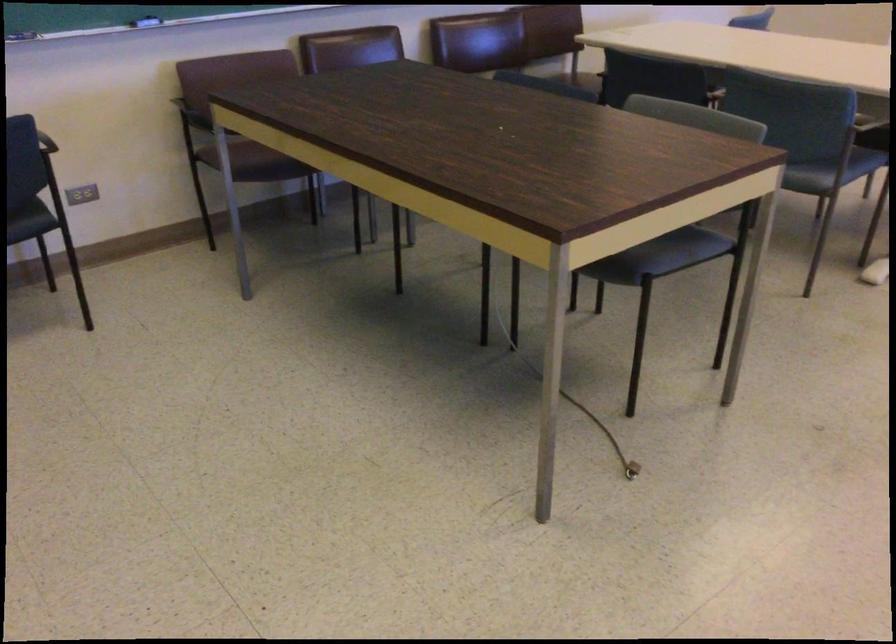
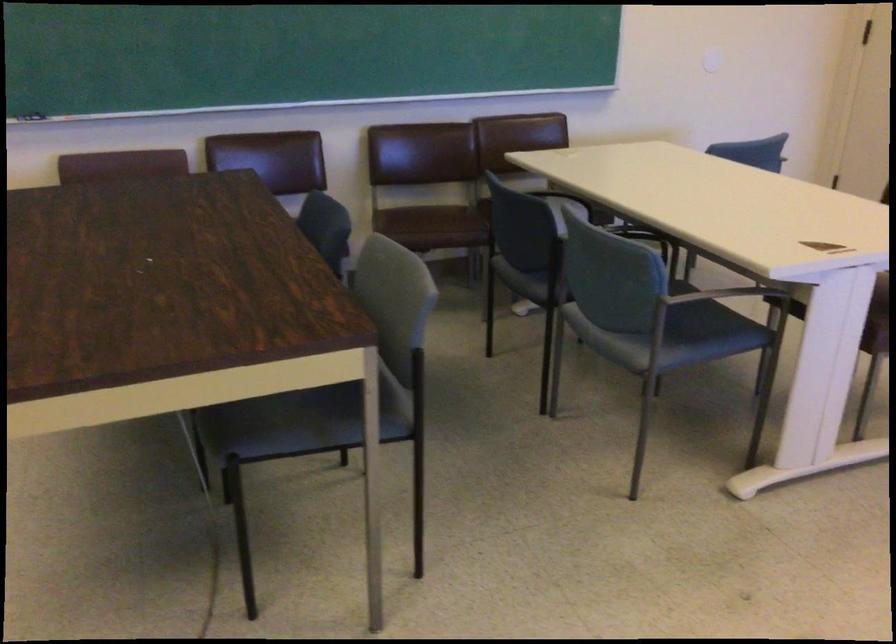
Find the pixel in the second image that matches the point at 633,249 in the first image.

(282, 424)